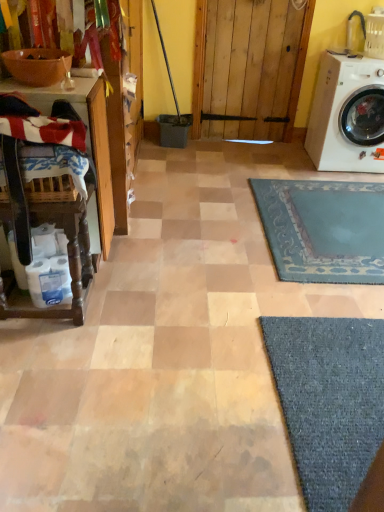
Question: Could you tell me if striped cotton laundry at left is facing wooden table at left, marked as the 2th table in a top-to-bottom arrangement?

Choices:
 (A) no
 (B) yes

Answer: (A)

Question: Can we say striped cotton laundry at left lies outside wooden table at left, marked as the 2th table in a top-to-bottom arrangement?

Choices:
 (A) no
 (B) yes

Answer: (B)

Question: From a real-world perspective, is striped cotton laundry at left located beneath wooden table at left, marked as the 2th table in a top-to-bottom arrangement?

Choices:
 (A) no
 (B) yes

Answer: (A)

Question: Considering the relative sizes of striped cotton laundry at left and wooden table at left, marked as the 2th table in a top-to-bottom arrangement, in the image provided, is striped cotton laundry at left shorter than wooden table at left, marked as the 2th table in a top-to-bottom arrangement,?

Choices:
 (A) yes
 (B) no

Answer: (A)

Question: Is striped cotton laundry at left bigger than wooden table at left, the 1th table in the bottom-to-top sequence?

Choices:
 (A) yes
 (B) no

Answer: (B)

Question: From the image's perspective, is striped cotton laundry at left above or below matte brown bowl at upper left?

Choices:
 (A) above
 (B) below

Answer: (B)

Question: Visually, is striped cotton laundry at left positioned to the left or to the right of matte brown bowl at upper left?

Choices:
 (A) left
 (B) right

Answer: (B)

Question: Based on their sizes in the image, would you say striped cotton laundry at left is bigger or smaller than matte brown bowl at upper left?

Choices:
 (A) small
 (B) big

Answer: (B)

Question: From a real-world perspective, is striped cotton laundry at left positioned above or below matte brown bowl at upper left?

Choices:
 (A) below
 (B) above

Answer: (A)

Question: Based on their positions, is wooden table at left, marked as the 2th table in a top-to-bottom arrangement, located to the left or right of matte brown bowl at upper left?

Choices:
 (A) right
 (B) left

Answer: (A)

Question: Is wooden table at left, marked as the 2th table in a top-to-bottom arrangement, wider or thinner than matte brown bowl at upper left?

Choices:
 (A) wide
 (B) thin

Answer: (A)

Question: From the image's perspective, is wooden table at left, the 1th table in the bottom-to-top sequence, above or below matte brown bowl at upper left?

Choices:
 (A) below
 (B) above

Answer: (A)

Question: Based on their sizes in the image, would you say wooden table at left, marked as the 2th table in a top-to-bottom arrangement, is bigger or smaller than matte brown bowl at upper left?

Choices:
 (A) small
 (B) big

Answer: (B)

Question: Do you think wooden table at left, marked as the 2th table in a top-to-bottom arrangement, is within wooden table at left, the second table from the bottom, or outside of it?

Choices:
 (A) inside
 (B) outside

Answer: (B)

Question: Is point tap(48, 210) positioned closer to the camera than point tap(104, 228)?

Choices:
 (A) closer
 (B) farther

Answer: (A)